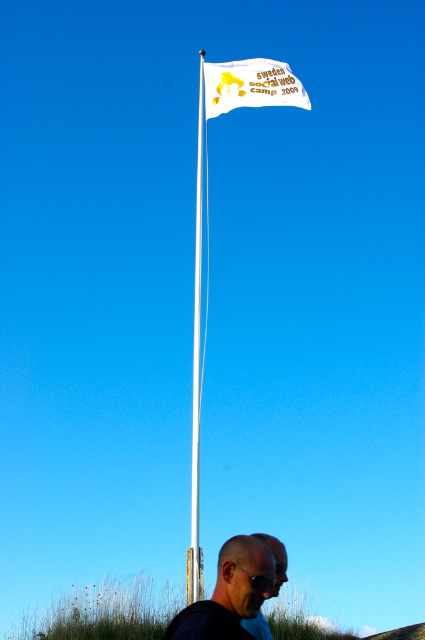
Question: Is green grass at lower center to the left of white plastic flag pole at upper center from the viewer's perspective?

Choices:
 (A) yes
 (B) no

Answer: (A)

Question: Which object is farther from the camera taking this photo?

Choices:
 (A) black plastic goggles at lower center
 (B) matte black sunglasses at lower center
 (C) white fabric flag at upper center

Answer: (C)

Question: Considering the relative positions of dark blue shirt at lower center and white fabric flag at upper center in the image provided, where is dark blue shirt at lower center located with respect to white fabric flag at upper center?

Choices:
 (A) left
 (B) right

Answer: (A)

Question: Is green grass at lower center bigger than white fabric flag at upper center?

Choices:
 (A) yes
 (B) no

Answer: (B)

Question: Which point appears closest to the camera in this image?

Choices:
 (A) (248, 577)
 (B) (278, 552)
 (C) (280, 632)

Answer: (A)

Question: Based on their relative distances, which object is farther from the white fabric flag at upper center?

Choices:
 (A) green grass at lower center
 (B) dark blue shirt at lower center
 (C) white plastic flag pole at upper center
 (D) black plastic goggles at lower center

Answer: (D)